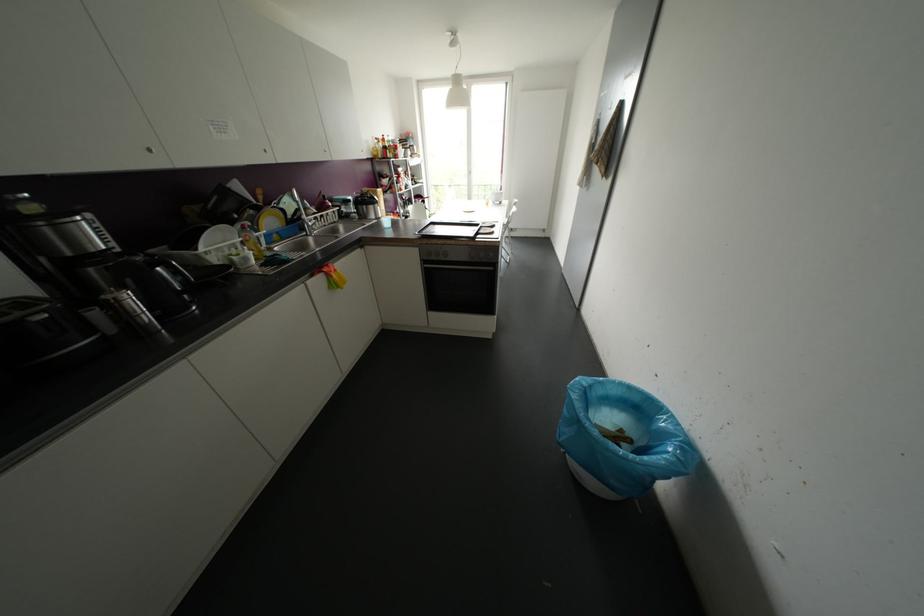
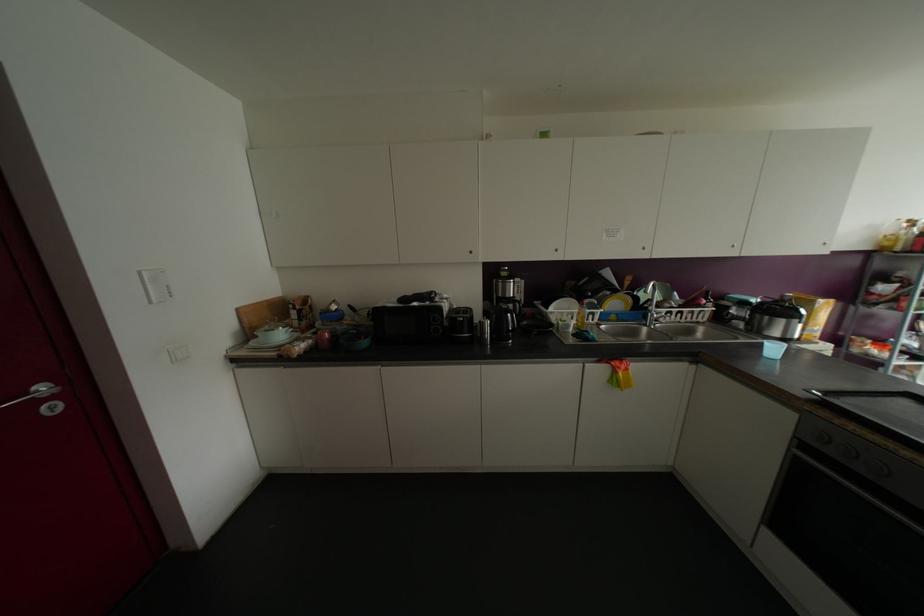
In the second image, find the point that corresponds to (x=149, y=150) in the first image.

(555, 249)